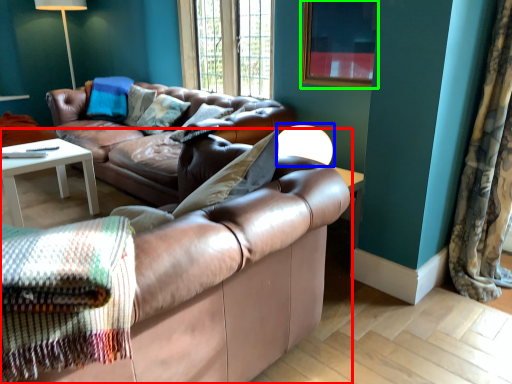
Question: Which is nearer to the studio couch (highlighted by a red box)? table lamp (highlighted by a blue box) or picture frame (highlighted by a green box).

Choices:
 (A) table lamp
 (B) picture frame

Answer: (A)